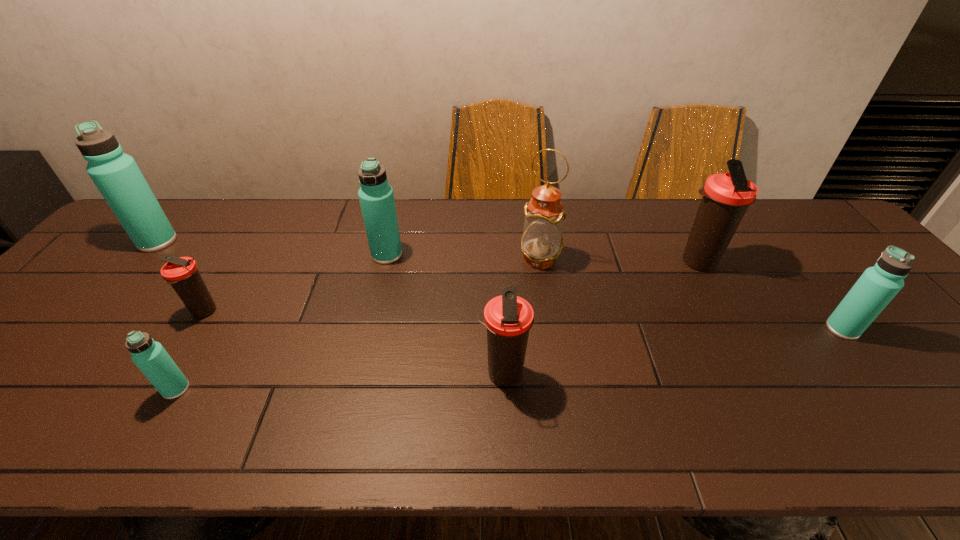
The image size is (960, 540). Identify the location of the biggest aqua thermos bottle. (116, 175).

Locate an element on the screen. This screenshot has height=540, width=960. the leftmost object is located at coordinates (116, 175).

I want to click on the sixth object from left to right, so click(542, 241).

The height and width of the screenshot is (540, 960). Find the location of `the fourth object from left to right`. the fourth object from left to right is located at coordinates (376, 197).

Identify the location of the second aqua thermos bottle from right to left. Image resolution: width=960 pixels, height=540 pixels. (376, 197).

Locate an element on the screen. This screenshot has height=540, width=960. the second thermos bottle from right to left is located at coordinates (726, 197).

Locate an element on the screen. The image size is (960, 540). the biggest brown thermos bottle is located at coordinates (726, 197).

Where is `the second biggest brown thermos bottle`? This screenshot has height=540, width=960. the second biggest brown thermos bottle is located at coordinates (508, 318).

I want to click on the fifth object from left to right, so click(508, 318).

Find the location of `the rightmost aqua thermos bottle`. the rightmost aqua thermos bottle is located at coordinates (878, 285).